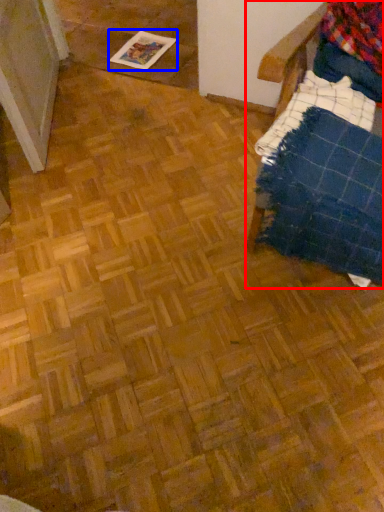
Question: Among these objects, which one is nearest to the camera, furniture (highlighted by a red box) or magazine (highlighted by a blue box)?

Choices:
 (A) furniture
 (B) magazine

Answer: (A)